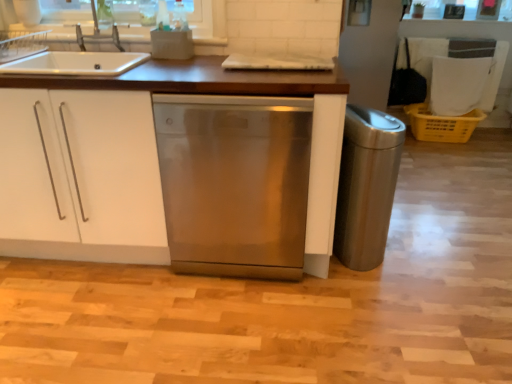
Question: From the image's perspective, is yellow plastic crate at right beneath stainless steel dishwasher at center?

Choices:
 (A) no
 (B) yes

Answer: (A)

Question: Is stainless steel dishwasher at center completely or partially inside yellow plastic crate at right?

Choices:
 (A) yes
 (B) no

Answer: (B)

Question: Considering the relative sizes of yellow plastic crate at right and stainless steel dishwasher at center in the image provided, is yellow plastic crate at right shorter than stainless steel dishwasher at center?

Choices:
 (A) no
 (B) yes

Answer: (B)

Question: From the image's perspective, does yellow plastic crate at right appear higher than stainless steel dishwasher at center?

Choices:
 (A) yes
 (B) no

Answer: (A)

Question: Is yellow plastic crate at right aimed at stainless steel dishwasher at center?

Choices:
 (A) yes
 (B) no

Answer: (B)

Question: From a real-world perspective, relative to stainless steel dishwasher at center, is white matte cabinet at center vertically above or below?

Choices:
 (A) above
 (B) below

Answer: (A)

Question: Visually, is white matte cabinet at center positioned to the left or to the right of stainless steel dishwasher at center?

Choices:
 (A) left
 (B) right

Answer: (A)

Question: Considering the positions of white matte cabinet at center and stainless steel dishwasher at center in the image, is white matte cabinet at center bigger or smaller than stainless steel dishwasher at center?

Choices:
 (A) big
 (B) small

Answer: (A)

Question: Considering the positions of white matte cabinet at center and stainless steel dishwasher at center in the image, is white matte cabinet at center wider or thinner than stainless steel dishwasher at center?

Choices:
 (A) wide
 (B) thin

Answer: (A)

Question: Is point (36, 152) positioned closer to the camera than point (1, 71)?

Choices:
 (A) farther
 (B) closer

Answer: (A)

Question: In terms of width, does white matte cabinet at center look wider or thinner when compared to satin silver sink at upper left?

Choices:
 (A) thin
 (B) wide

Answer: (B)

Question: From the image's perspective, is white matte cabinet at center above or below satin silver sink at upper left?

Choices:
 (A) above
 (B) below

Answer: (B)

Question: Considering the positions of white matte cabinet at center and satin silver sink at upper left in the image, is white matte cabinet at center bigger or smaller than satin silver sink at upper left?

Choices:
 (A) small
 (B) big

Answer: (B)

Question: Is point (345, 193) closer or farther from the camera than point (269, 117)?

Choices:
 (A) closer
 (B) farther

Answer: (B)

Question: Based on their positions, is stainless steel trash can at right located to the left or right of stainless steel dishwasher at center?

Choices:
 (A) right
 (B) left

Answer: (A)